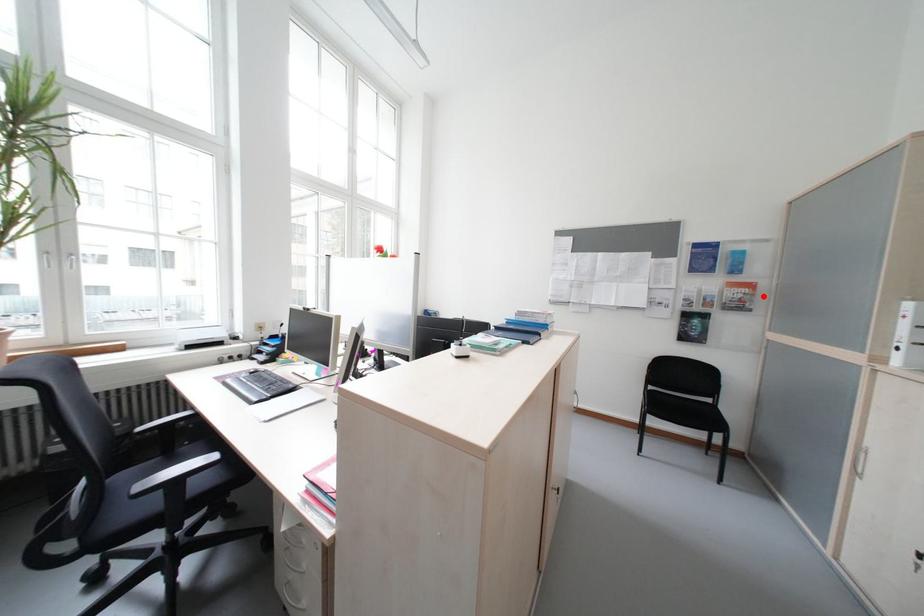
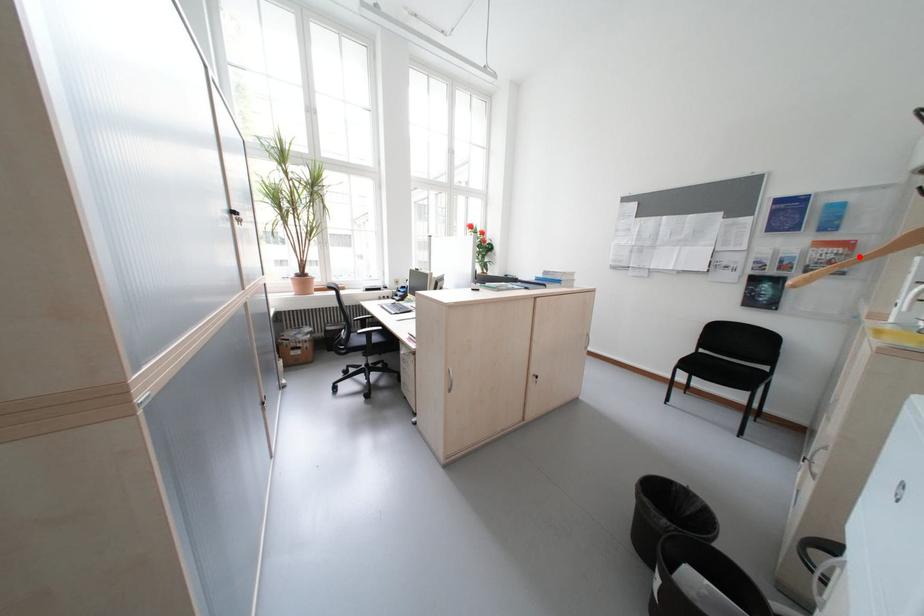
I am providing you with two images of the same scene from different viewpoints. A red point is marked on the first image and another point is marked on the second image. Does the point marked in image1 correspond to the same location as the one in image2?

Yes